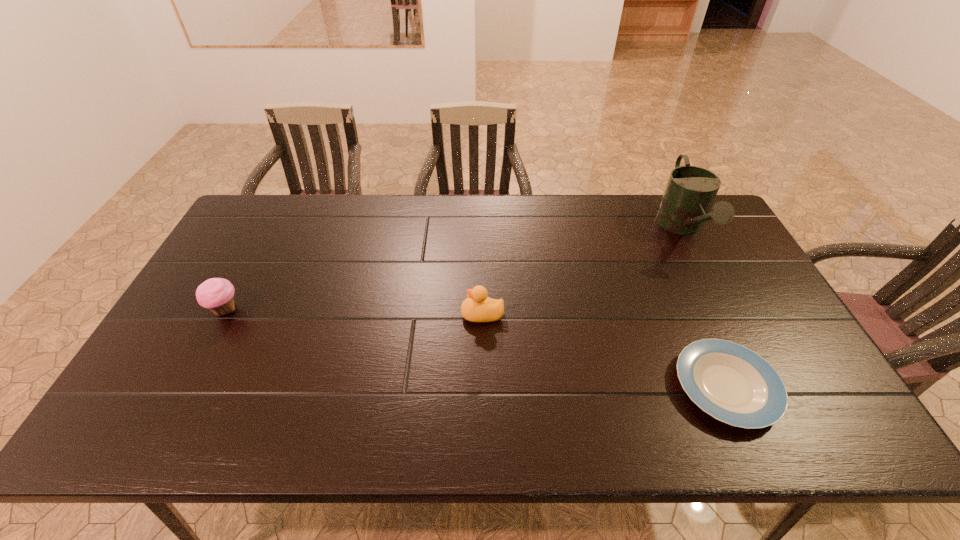
You are a GUI agent. You are given a task and a screenshot of the screen. Output one action in this format:
    pyautogui.click(x=<x>, y=<y>)
    Task: Click on the free location located 0.320m on the face of the third object from right to left
    The height and width of the screenshot is (540, 960).
    Given the screenshot: What is the action you would take?
    pyautogui.click(x=346, y=314)

Where is `vacant space located 0.130m on the back of the nearest object`? vacant space located 0.130m on the back of the nearest object is located at coordinates (691, 308).

The height and width of the screenshot is (540, 960). Find the location of `object that is at the far edge`. object that is at the far edge is located at coordinates (689, 194).

I want to click on object positioned at the near edge, so click(x=733, y=384).

In order to click on object at the left edge in this screenshot , I will do `click(217, 294)`.

The image size is (960, 540). I want to click on watering can that is at the right edge, so click(689, 194).

You are a GUI agent. You are given a task and a screenshot of the screen. Output one action in this format:
    pyautogui.click(x=<x>, y=<y>)
    Task: Click on the plate that is at the right edge
    The image size is (960, 540).
    Given the screenshot: What is the action you would take?
    pyautogui.click(x=733, y=384)

The height and width of the screenshot is (540, 960). Identify the location of object that is at the far right corner. point(689,194).

This screenshot has height=540, width=960. I want to click on object that is at the near right corner, so click(733, 384).

The image size is (960, 540). Identify the location of free space at the far edge. (573, 210).